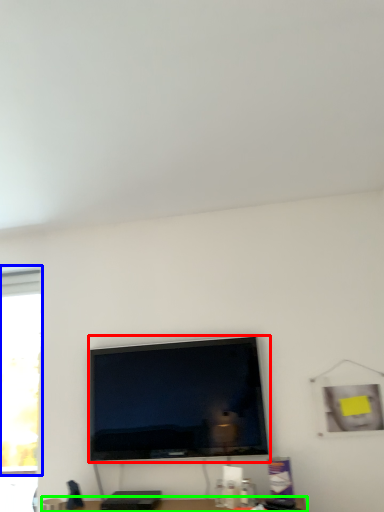
Question: Which is nearer to the television (highlighted by a red box)? window (highlighted by a blue box) or furniture (highlighted by a green box).

Choices:
 (A) window
 (B) furniture

Answer: (B)